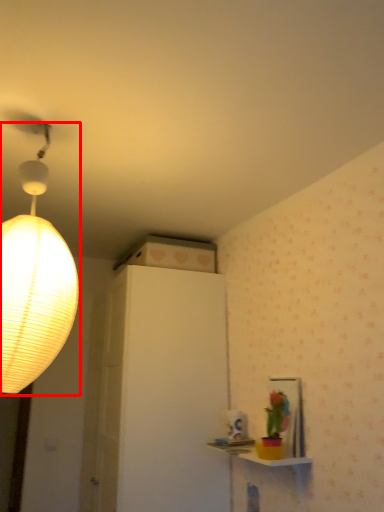
Question: From the image's perspective, where is lamp (annotated by the red box) located in relation to table in the image?

Choices:
 (A) above
 (B) below

Answer: (A)